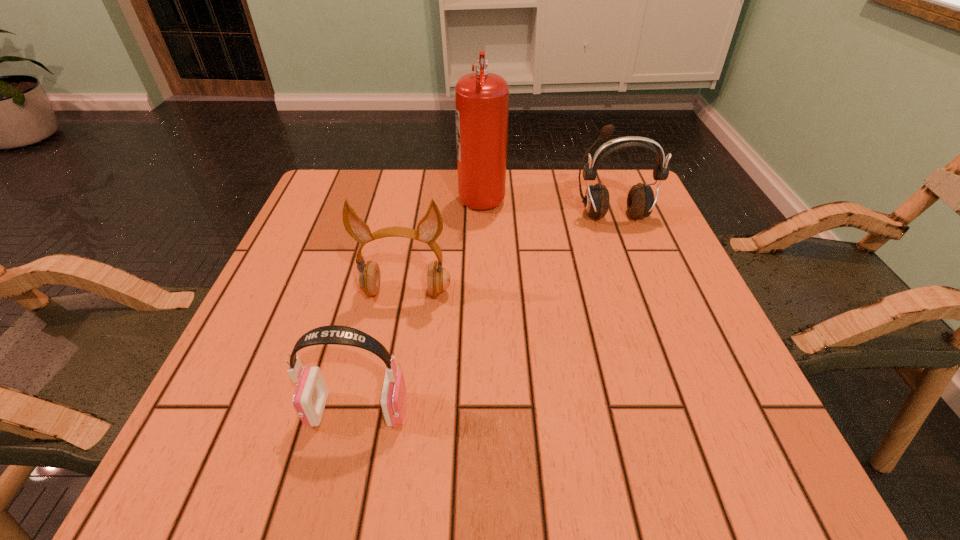
This screenshot has height=540, width=960. Identify the location of free region located 0.200m on the ear pads of the rightmost earphone. (638, 286).

Where is `free region located on the front-facing side of the third farthest object`? The image size is (960, 540). free region located on the front-facing side of the third farthest object is located at coordinates (396, 342).

Where is `free spot located 0.350m on the outer surface of the shortest earphone`? free spot located 0.350m on the outer surface of the shortest earphone is located at coordinates (627, 410).

Where is `fire extinguisher that is at the far edge`? fire extinguisher that is at the far edge is located at coordinates (481, 99).

I want to click on earphone situated at the far edge, so click(x=640, y=201).

Find the location of a particular element. This screenshot has height=540, width=960. object present at the near edge is located at coordinates (311, 393).

Locate an element on the screen. The height and width of the screenshot is (540, 960). object positioned at the right edge is located at coordinates (640, 201).

Where is `object positioned at the far right corner`? This screenshot has height=540, width=960. object positioned at the far right corner is located at coordinates (640, 201).

The image size is (960, 540). Find the location of `vacant space at the far edge of the desktop`. vacant space at the far edge of the desktop is located at coordinates (442, 184).

The image size is (960, 540). In the image, there is a desktop. Find the location of `vacant area at the near edge`. vacant area at the near edge is located at coordinates (361, 465).